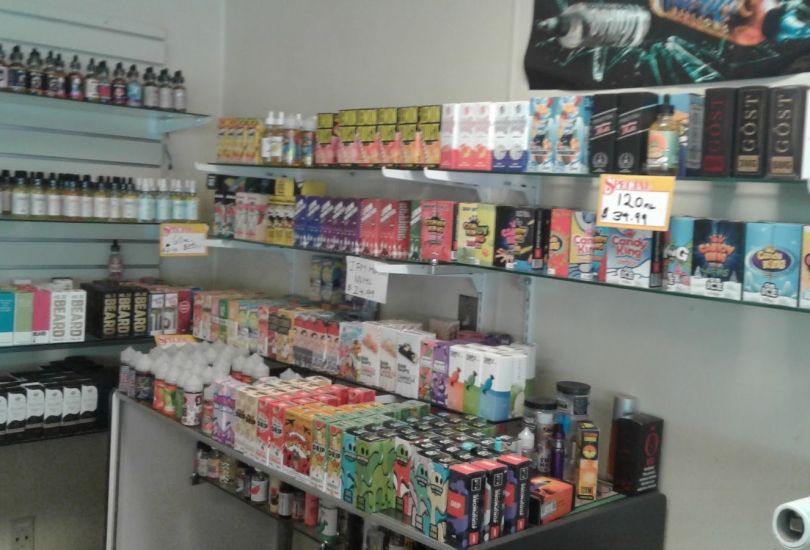
Find the location of a particular element. row of bottles on a shelf is located at coordinates click(x=71, y=191), click(x=124, y=90), click(x=275, y=142).